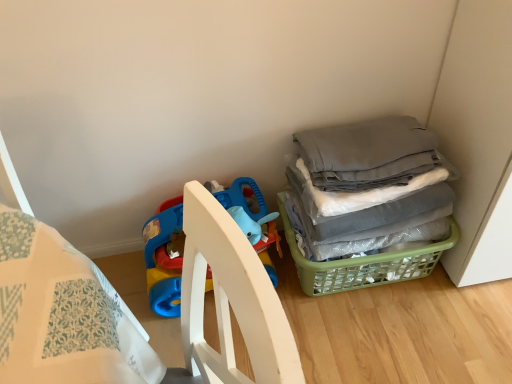
Question: Is gray fabric at right to the left or to the right of green plastic basket at lower right in the image?

Choices:
 (A) left
 (B) right

Answer: (B)

Question: Considering the positions of gray fabric at right and green plastic basket at lower right in the image, is gray fabric at right bigger or smaller than green plastic basket at lower right?

Choices:
 (A) small
 (B) big

Answer: (B)

Question: Estimate the real-world distances between objects in this image. Which object is farther from the plastic blue playpen at lower left?

Choices:
 (A) gray fabric at right
 (B) green plastic basket at lower right

Answer: (A)

Question: Which object is positioned closest to the plastic blue playpen at lower left?

Choices:
 (A) gray fabric at right
 (B) green plastic basket at lower right

Answer: (B)